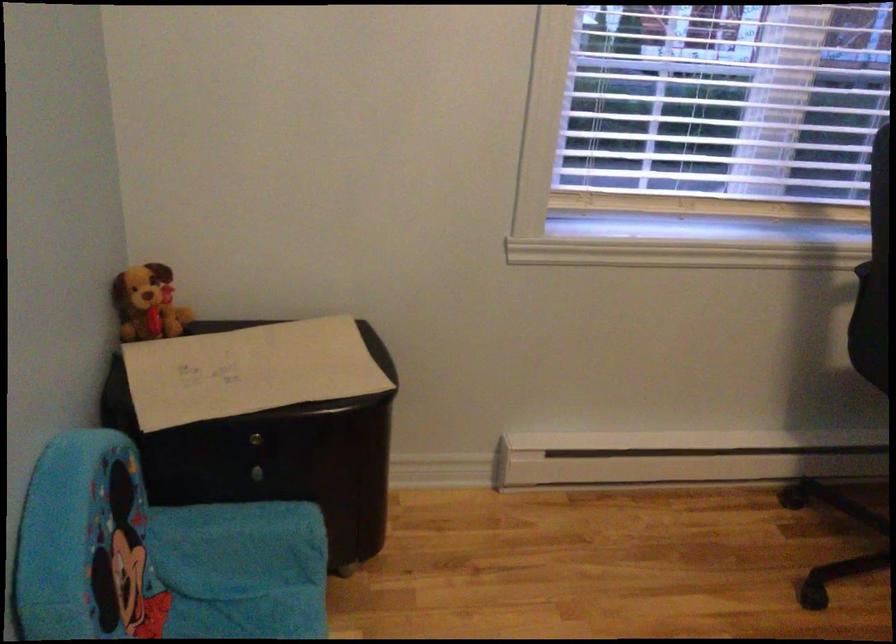
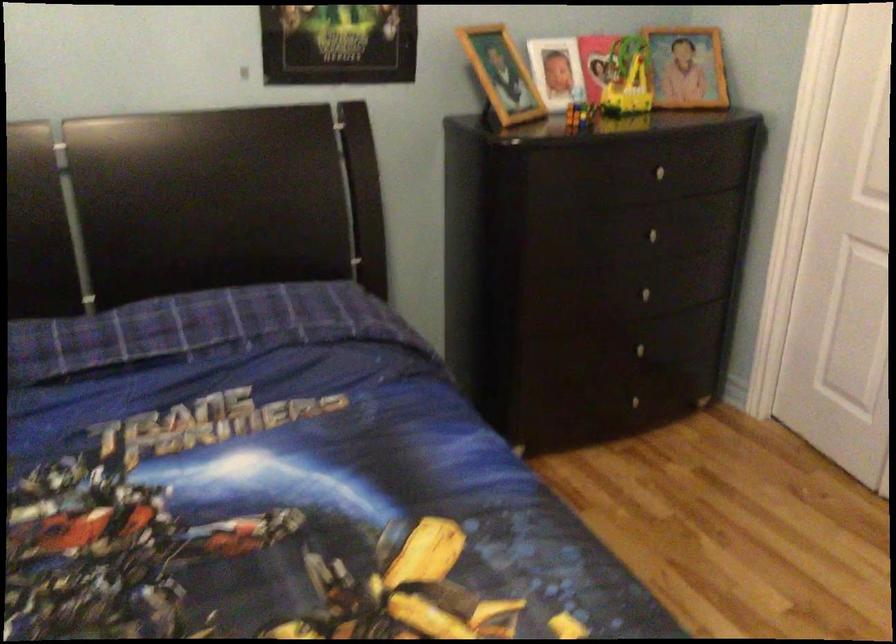
First-person continuous shooting, in which direction is the camera rotating?

The camera rotated toward right-down.